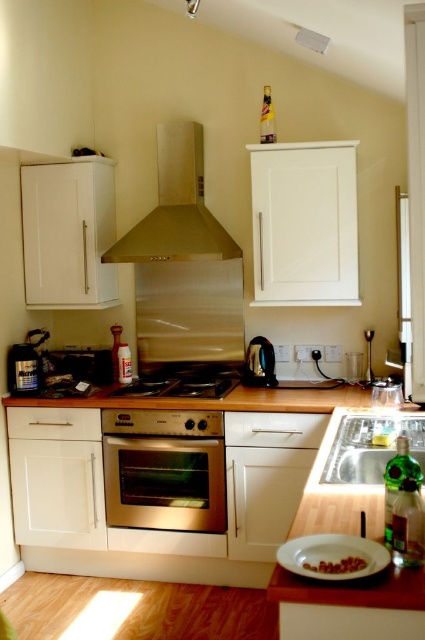
Consider the image. Is gold metallic exhaust hood at center bigger than metallic silver canister at left?

Yes.

Which of these two, gold metallic exhaust hood at center or metallic silver canister at left, stands shorter?

metallic silver canister at left

Is point (129, 236) less distant than point (14, 365)?

No, it is not.

Identify the location of gold metallic exhaust hood at center. The width and height of the screenshot is (425, 640). (176, 208).

Which is more to the right, satin silver gas stove at center or brown matte nuts at lower center?

brown matte nuts at lower center is more to the right.

The height and width of the screenshot is (640, 425). I want to click on satin silver gas stove at center, so click(x=186, y=380).

You are a GUI agent. You are given a task and a screenshot of the screen. Output one action in this format:
    pyautogui.click(x=<x>, y=<y>)
    Task: Click on the satin silver gas stove at center
    The width and height of the screenshot is (425, 640).
    Given the screenshot: What is the action you would take?
    pyautogui.click(x=186, y=380)

Between silver metallic sink at lower right and brown matte nuts at lower center, which one is positioned higher?

Positioned higher is silver metallic sink at lower right.

Consider the image. Can you confirm if silver metallic sink at lower right is positioned below brown matte nuts at lower center?

Actually, silver metallic sink at lower right is above brown matte nuts at lower center.

Does point (351, 465) come farther from viewer compared to point (362, 564)?

Yes, it is.

Where is `silver metallic sink at lower right`? Image resolution: width=425 pixels, height=640 pixels. silver metallic sink at lower right is located at coordinates (365, 445).